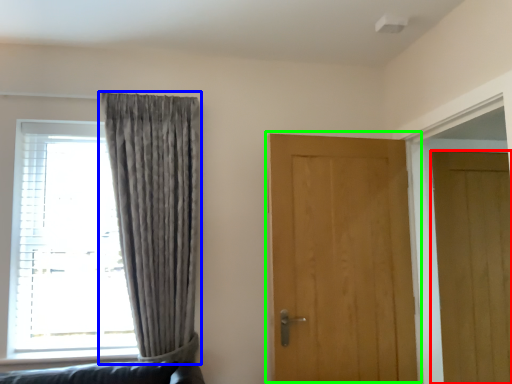
Question: Which is nearer to the door (highlighted by a red box)? curtain (highlighted by a blue box) or door (highlighted by a green box).

Choices:
 (A) curtain
 (B) door

Answer: (B)